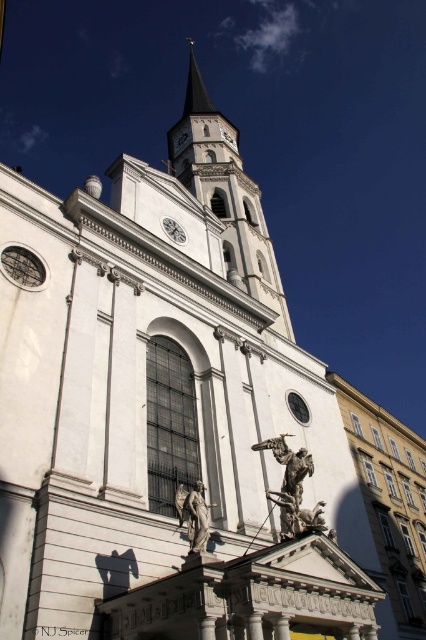
You are an architect planning to install a new lighting system between the white stone clock tower at upper center and the polished bronze statue at lower center. The system requires a cable that can span the distance between them. What is the minimum length of cable you need to ensure it reaches between the two structures?

The white stone clock tower at upper center and polished bronze statue at lower center are 65.82 meters apart, so the minimum cable length required is 65.82 meters.

You are standing at the entrance of the grand classical church and want to locate the white stone clock tower at upper center. According to the image, what are the coordinates of its position?

The white stone clock tower at upper center is located at coordinates [227,195].

You are a tour guide leading a group to the bronze statue at center. You see the polished bronze statue at lower center nearby. How far apart are these two bronze statues?

The bronze statue at center and the polished bronze statue at lower center are 21.03 feet apart from each other.